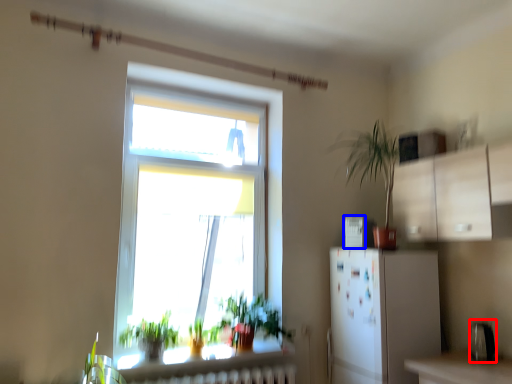
Question: Which of the following is the closest to the observer, appliance (highlighted by a red box) or appliance (highlighted by a blue box)?

Choices:
 (A) appliance
 (B) appliance

Answer: (A)